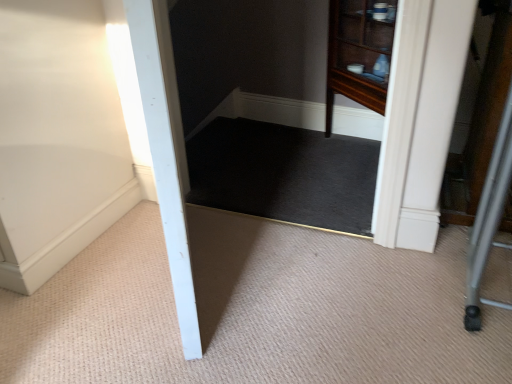
Question: From their relative heights in the image, would you say black carpet at center is taller or shorter than carpet at center?

Choices:
 (A) short
 (B) tall

Answer: (A)

Question: Considering the relative positions of black carpet at center and carpet at center in the image provided, is black carpet at center to the left or to the right of carpet at center?

Choices:
 (A) left
 (B) right

Answer: (B)

Question: Does point (219, 140) appear closer or farther from the camera than point (241, 218)?

Choices:
 (A) farther
 (B) closer

Answer: (A)

Question: From a real-world perspective, is carpet at center positioned above or below black carpet at center?

Choices:
 (A) above
 (B) below

Answer: (B)

Question: Which is correct: carpet at center is inside black carpet at center, or outside of it?

Choices:
 (A) inside
 (B) outside

Answer: (B)

Question: Does point (386, 369) appear closer or farther from the camera than point (340, 142)?

Choices:
 (A) closer
 (B) farther

Answer: (A)

Question: In terms of width, does carpet at center look wider or thinner when compared to black carpet at center?

Choices:
 (A) wide
 (B) thin

Answer: (A)